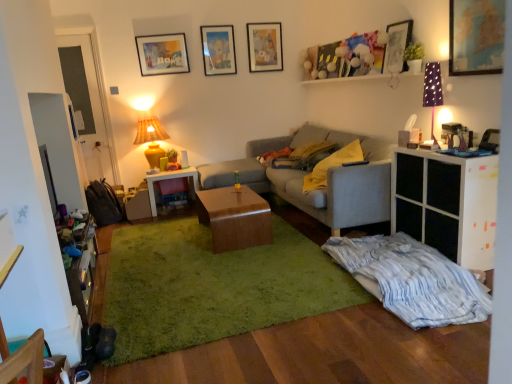
Question: Can you confirm if wooden armchair at lower left is taller than white matte cabinet at right?

Choices:
 (A) no
 (B) yes

Answer: (A)

Question: Does wooden armchair at lower left appear on the left side of white matte cabinet at right?

Choices:
 (A) no
 (B) yes

Answer: (B)

Question: Is wooden armchair at lower left behind white matte cabinet at right?

Choices:
 (A) no
 (B) yes

Answer: (A)

Question: Does wooden armchair at lower left have a greater width compared to white matte cabinet at right?

Choices:
 (A) yes
 (B) no

Answer: (B)

Question: Is wooden armchair at lower left completely or partially outside of white matte cabinet at right?

Choices:
 (A) yes
 (B) no

Answer: (A)

Question: Considering the positions of point (87, 296) and point (137, 354), is point (87, 296) closer or farther from the camera than point (137, 354)?

Choices:
 (A) closer
 (B) farther

Answer: (B)

Question: From a real-world perspective, is wooden dresser at lower left physically located above or below green shaggy rug at center?

Choices:
 (A) above
 (B) below

Answer: (A)

Question: Considering the positions of wooden dresser at lower left and green shaggy rug at center in the image, is wooden dresser at lower left wider or thinner than green shaggy rug at center?

Choices:
 (A) thin
 (B) wide

Answer: (A)

Question: Is wooden dresser at lower left bigger or smaller than green shaggy rug at center?

Choices:
 (A) small
 (B) big

Answer: (A)

Question: Considering the positions of white matte cabinet at right and yellow fabric pillow at center in the image, is white matte cabinet at right wider or thinner than yellow fabric pillow at center?

Choices:
 (A) thin
 (B) wide

Answer: (A)

Question: From their relative heights in the image, would you say white matte cabinet at right is taller or shorter than yellow fabric pillow at center?

Choices:
 (A) tall
 (B) short

Answer: (A)

Question: Is white matte cabinet at right inside the boundaries of yellow fabric pillow at center, or outside?

Choices:
 (A) inside
 (B) outside

Answer: (B)

Question: Looking at the image, does white matte cabinet at right seem bigger or smaller compared to yellow fabric pillow at center?

Choices:
 (A) small
 (B) big

Answer: (B)

Question: Is white glossy desk at center taller or shorter than gray fabric couch at center?

Choices:
 (A) tall
 (B) short

Answer: (B)

Question: Do you think white glossy desk at center is within gray fabric couch at center, or outside of it?

Choices:
 (A) inside
 (B) outside

Answer: (B)